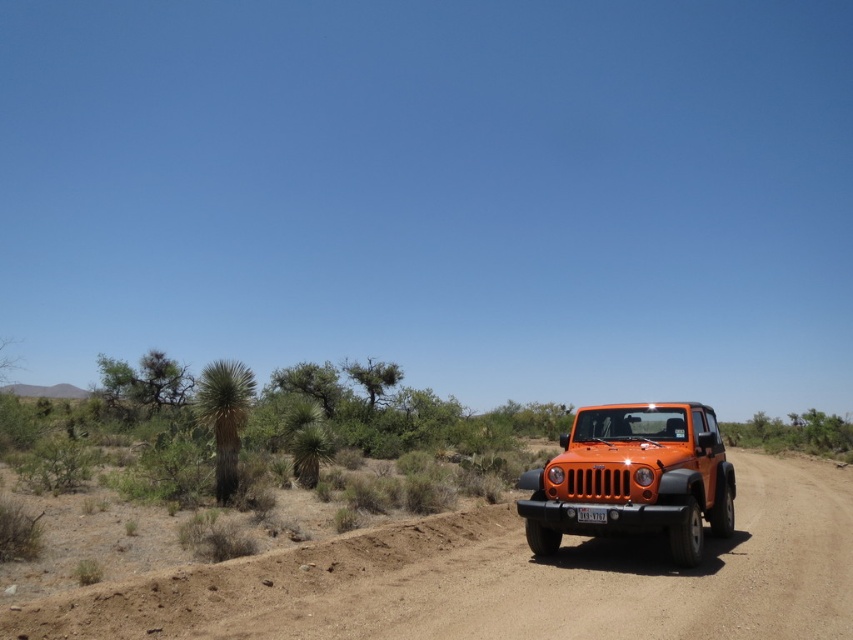
Is dirt track at center taller than orange matte jeep at center?

Indeed, dirt track at center has a greater height compared to orange matte jeep at center.

Can you confirm if dirt track at center is bigger than orange matte jeep at center?

Yes, dirt track at center is bigger than orange matte jeep at center.

Identify the location of dirt track at center. This screenshot has width=853, height=640. (506, 580).

Locate an element on the screen. The height and width of the screenshot is (640, 853). dirt track at center is located at coordinates (506, 580).